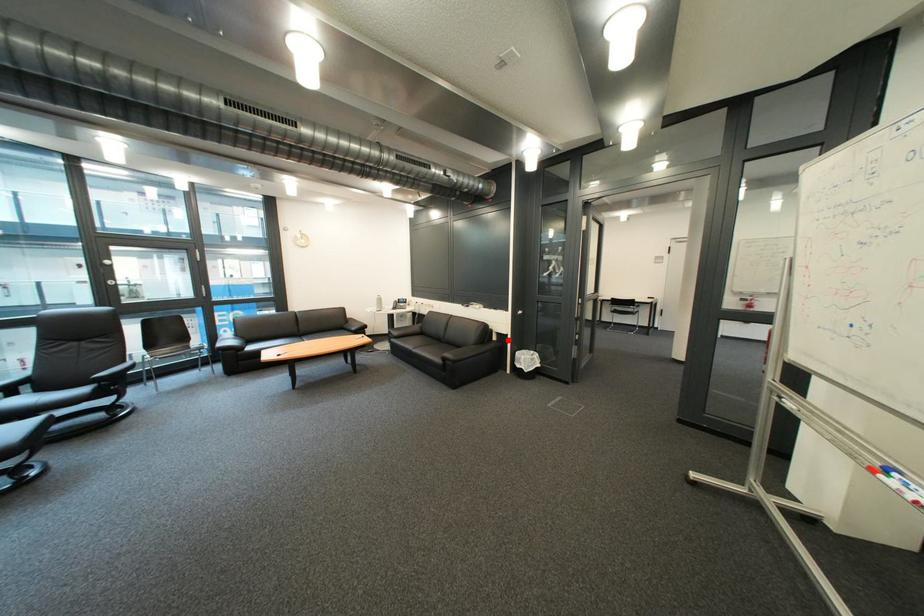
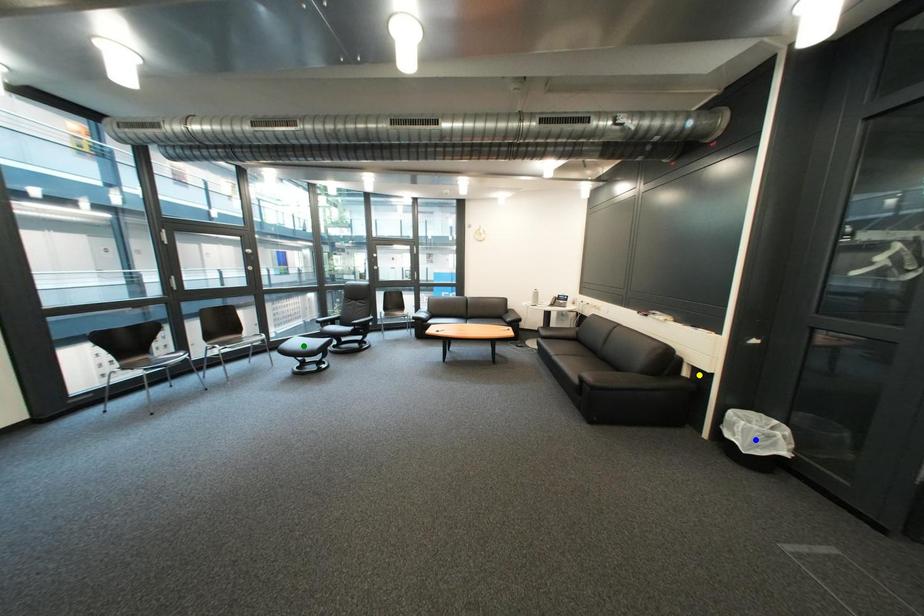
Question: I am providing you with two images of the same scene from different viewpoints. A red point is marked on the first image. You are given multiple points on the second image. Which spot in image 2 lines up with the point in image 1?

Choices:
 (A) yellow point
 (B) green point
 (C) blue point

Answer: (A)